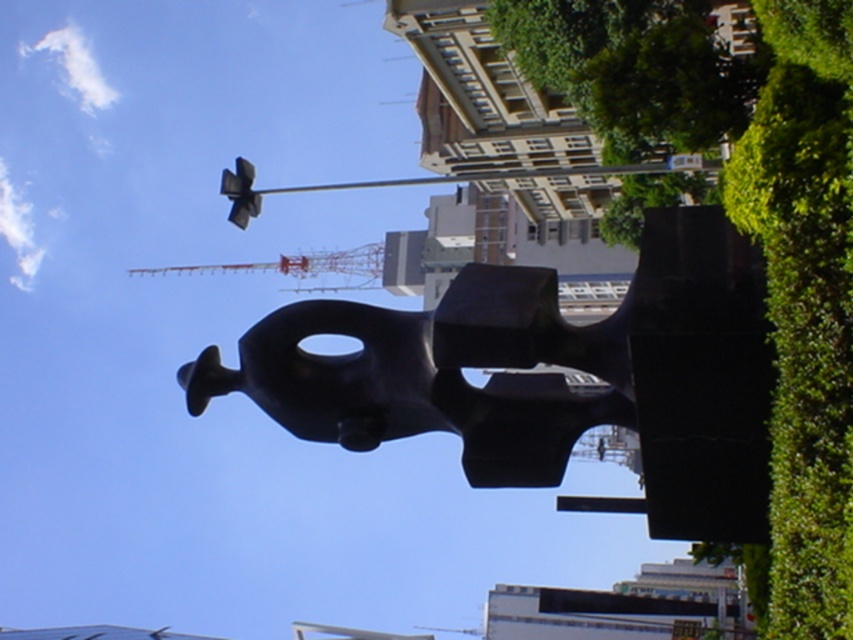
Question: Which of the following is the farthest from the observer?

Choices:
 (A) (657, 426)
 (B) (785, 444)

Answer: (A)

Question: Is black matte statue at center positioned before green leafy hedge at right?

Choices:
 (A) no
 (B) yes

Answer: (A)

Question: Which point is farther from the camera taking this photo?

Choices:
 (A) (820, 228)
 (B) (543, 326)

Answer: (B)

Question: Among these points, which one is farthest from the camera?

Choices:
 (A) (540, 269)
 (B) (756, 218)

Answer: (A)

Question: From the image, what is the correct spatial relationship of black matte statue at center in relation to green leafy hedge at right?

Choices:
 (A) left
 (B) right

Answer: (A)

Question: Does black matte statue at center lie in front of green leafy hedge at right?

Choices:
 (A) yes
 (B) no

Answer: (B)